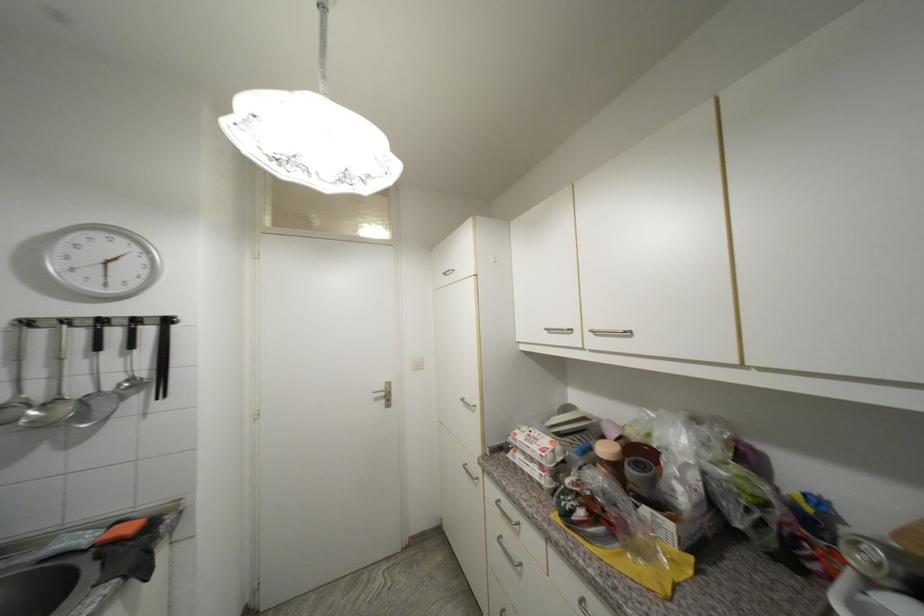
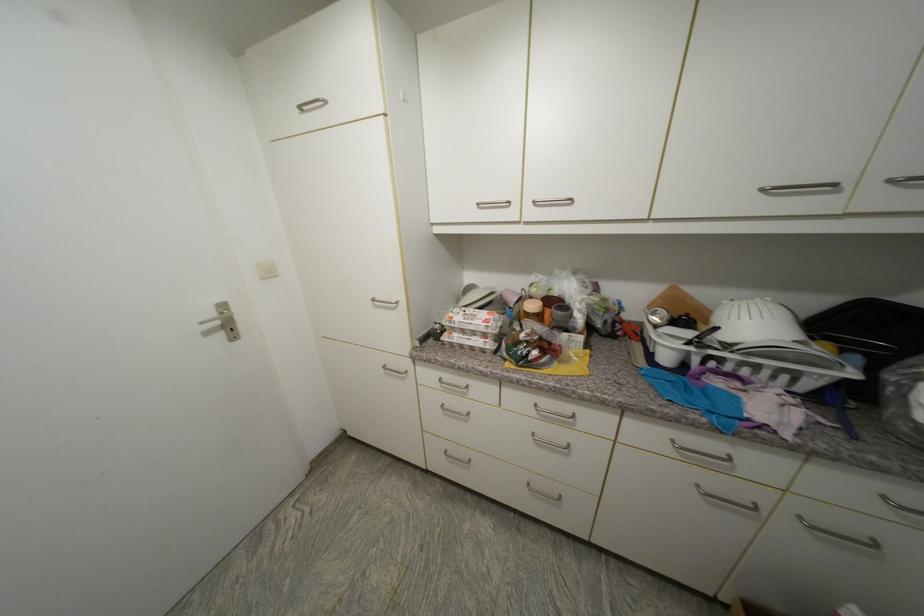
The point at (450, 276) is marked in the first image. Where is the corresponding point in the second image?

(307, 108)